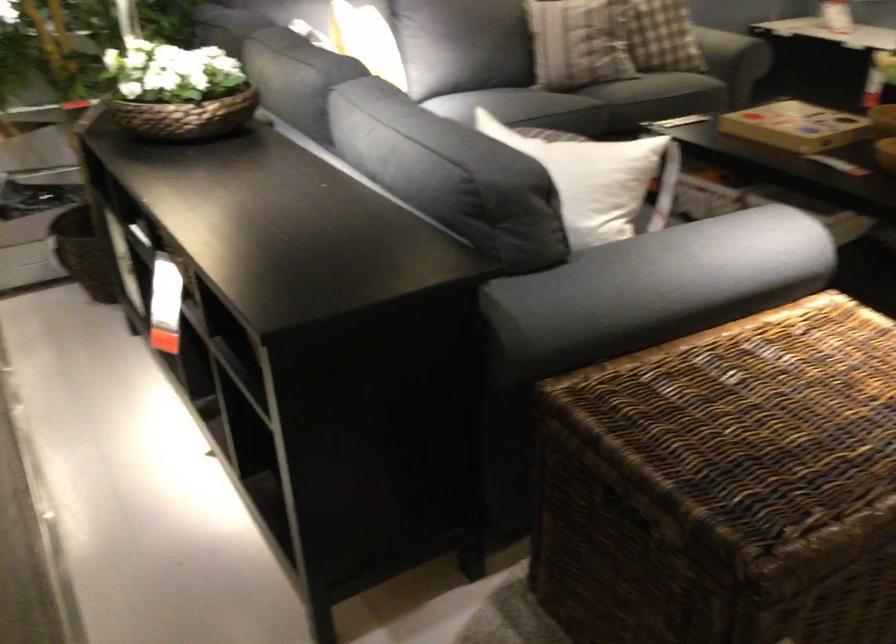
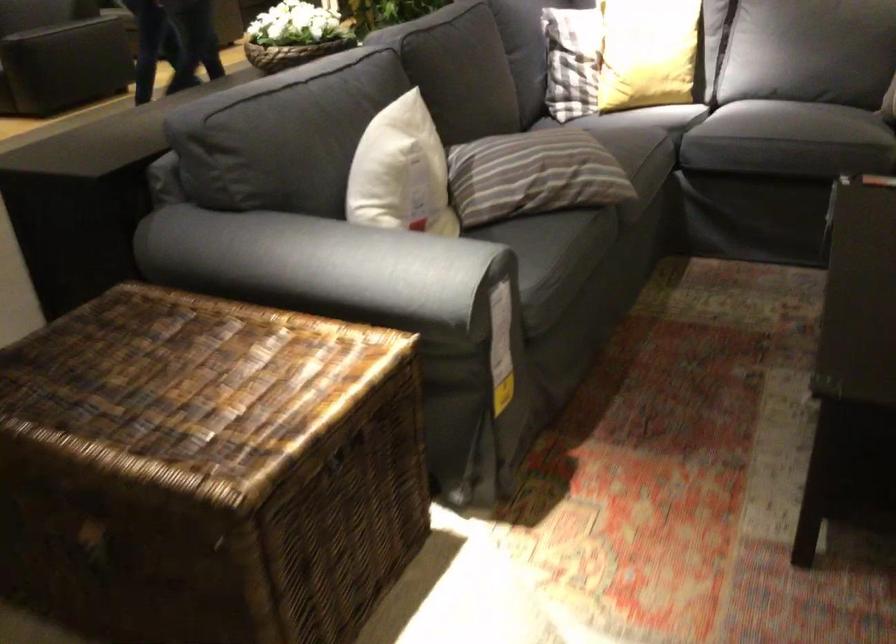
Where in the second image is the point corresponding to the point at 764,380 from the first image?

(195, 389)